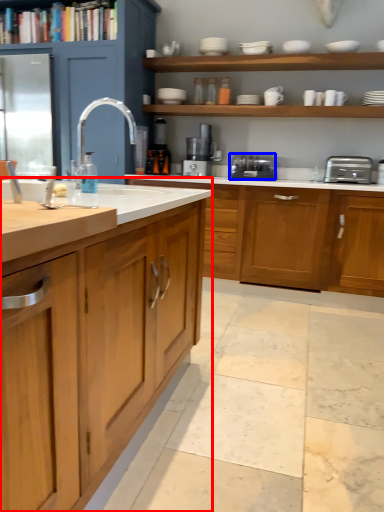
Question: Which of the following is the farthest to the observer, countertop (highlighted by a red box) or toaster (highlighted by a blue box)?

Choices:
 (A) countertop
 (B) toaster

Answer: (B)